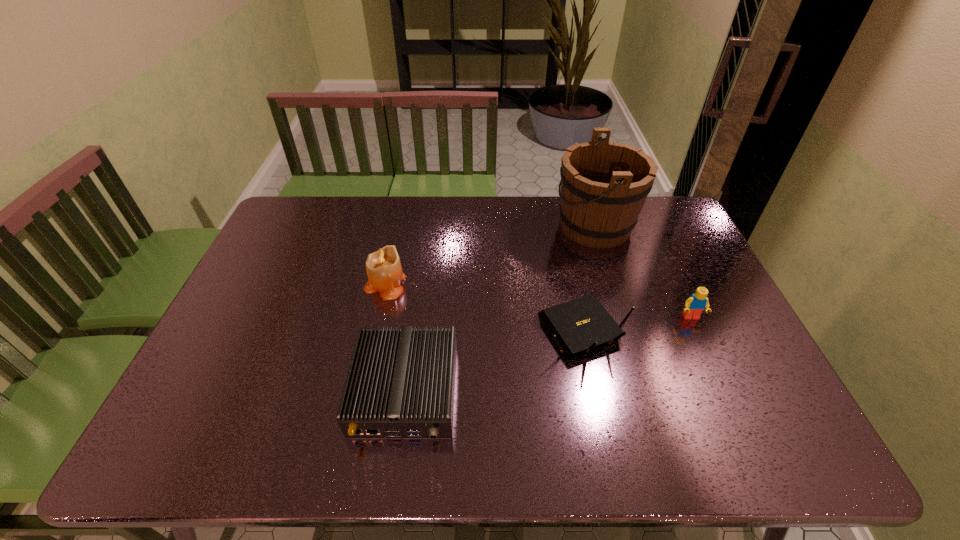
Identify the location of free spot between the wine bucket and the rightmost object. The image size is (960, 540). (643, 272).

Where is `vacant space that is in between the right router and the farthest object`? Image resolution: width=960 pixels, height=540 pixels. vacant space that is in between the right router and the farthest object is located at coordinates (589, 278).

The width and height of the screenshot is (960, 540). I want to click on free area in between the left router and the rightmost object, so click(548, 354).

You are a GUI agent. You are given a task and a screenshot of the screen. Output one action in this format:
    pyautogui.click(x=<x>, y=<y>)
    Task: Click on the free spot between the tallest object and the rightmost object
    
    Given the screenshot: What is the action you would take?
    pyautogui.click(x=643, y=272)

Find the location of a particular element. free point between the fourth shortest object and the rightmost object is located at coordinates (538, 301).

Where is `free space between the tallest object and the left router`? The height and width of the screenshot is (540, 960). free space between the tallest object and the left router is located at coordinates (500, 308).

The width and height of the screenshot is (960, 540). What are the coordinates of `free space between the farthest object and the left router` in the screenshot? It's located at (500, 308).

In order to click on unoccupied position between the farthest object and the rightmost object in this screenshot , I will do `click(643, 272)`.

The image size is (960, 540). I want to click on object identified as the fourth closest to the tallest object, so click(383, 267).

Image resolution: width=960 pixels, height=540 pixels. Identify the location of object that is the second closest one to the Lego. (604, 185).